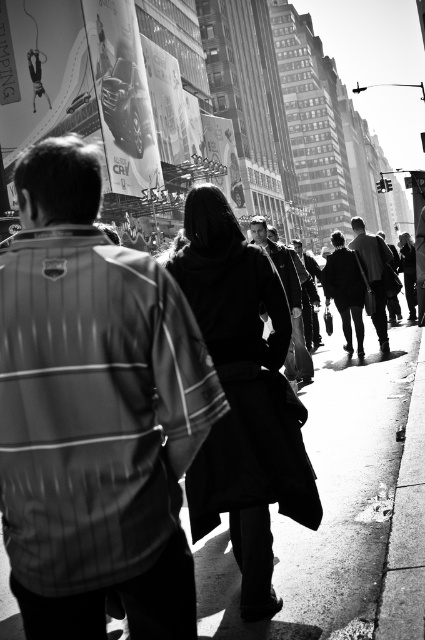
Question: Does black wool coat at center come in front of metallic silver menorah at center?

Choices:
 (A) no
 (B) yes

Answer: (B)

Question: Does striped fabric jacket at upper left come behind metallic silver menorah at center?

Choices:
 (A) no
 (B) yes

Answer: (A)

Question: Among these points, which one is farthest from the camera?

Choices:
 (A) (286, 548)
 (B) (280, 426)

Answer: (A)

Question: Does striped fabric jacket at upper left come in front of black wool coat at center?

Choices:
 (A) yes
 (B) no

Answer: (A)

Question: Estimate the real-world distances between objects in this image. Which object is closer to the smooth asphalt sidewalk at center?

Choices:
 (A) black wool coat at center
 (B) metallic silver car at upper center

Answer: (A)

Question: Which of the following is the closest to the observer?

Choices:
 (A) (110, 157)
 (B) (215, 115)
 (C) (189, 509)

Answer: (C)